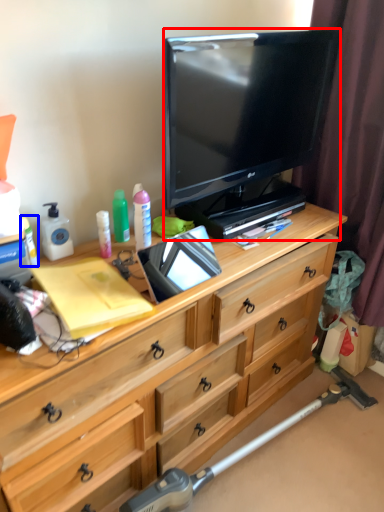
Question: Among these objects, which one is nearest to the camera, television (highlighted by a red box) or toiletry (highlighted by a blue box)?

Choices:
 (A) television
 (B) toiletry

Answer: (A)